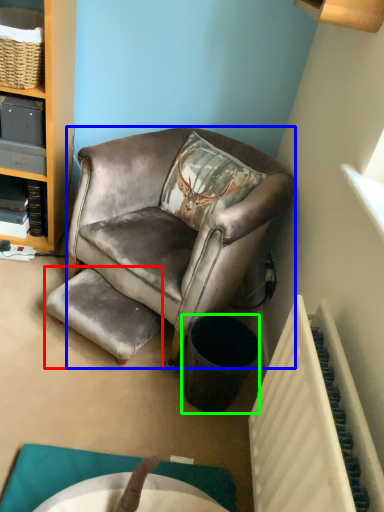
Question: Which object is positioned farthest from stool (highlighted by a red box)? Select from chair (highlighted by a blue box) and trash bin/can (highlighted by a green box).

Choices:
 (A) chair
 (B) trash bin/can

Answer: (B)